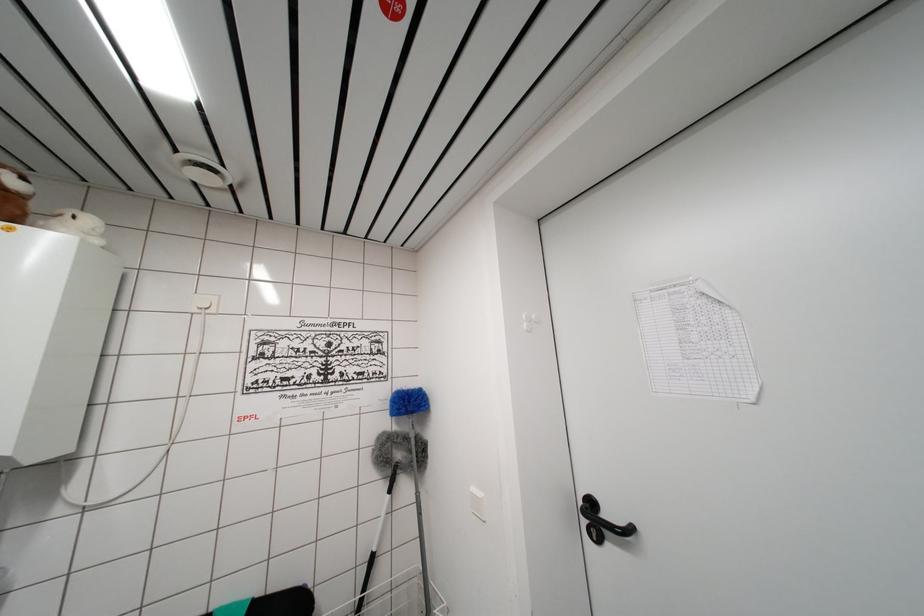
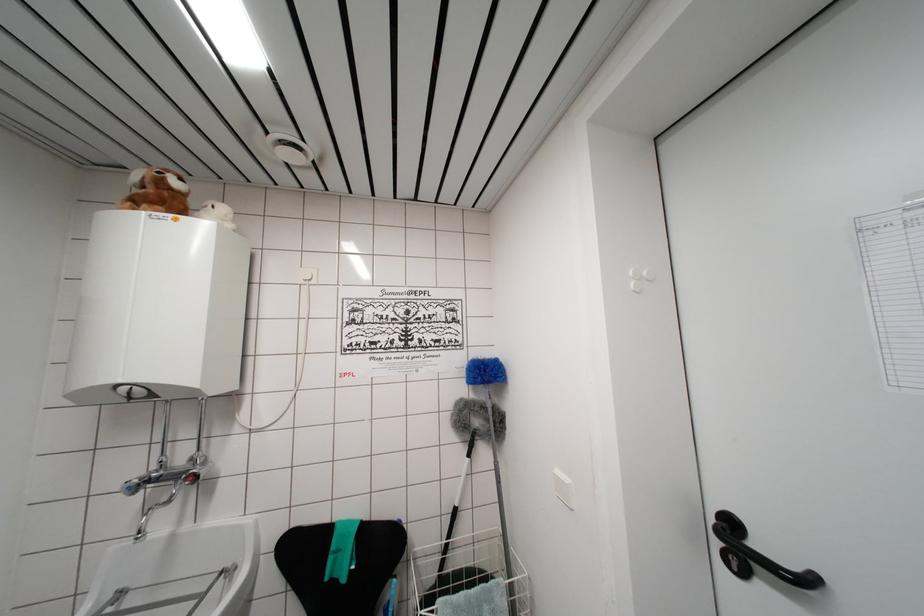
Find the pixel in the second image that matches pixel 599 543 in the first image.

(738, 573)